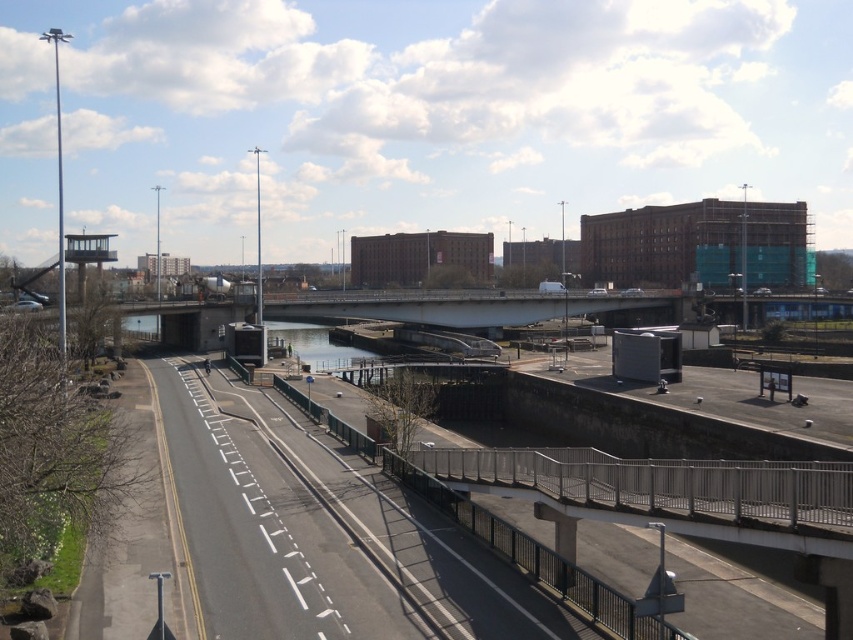
You are a delivery driver who needs to cross the white concrete bridge at center and the clear water at center. Based on the scene, which one do you think is wider?

The white concrete bridge at center is wider than clear water at center according to the description.

You are a city planner reviewing this urban layout. You need to decide whether to place a new traffic light on the white concrete bridge at center or the clear water at center. Based on their sizes, which location would be more appropriate for the traffic light?

The white concrete bridge at center is bigger than clear water at center, so placing the traffic light on the white concrete bridge at center would be more appropriate due to its larger size providing a stable foundation.

You are a drone operator who needs to fly a drone from the multi lane road in the foreground to the white concrete bridge at center. Based on the scene description, what is the shortest path the drone can take without crossing any obstacles like the metal railing or the waterway?

The shortest path for the drone would be to fly directly from the multi lane road in the foreground towards the white concrete bridge at center, as it is located at point [461,305]. The drone should avoid the metal railing on the right and the waterway below the bridge by navigating over the grassy area on the left side of the road and following the bridge deck.